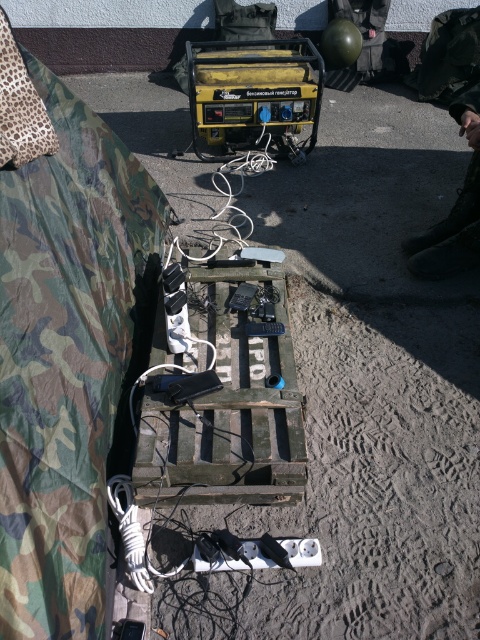
Can you confirm if yellow plastic generator at center is smaller than white cable at center?

No.

Is the position of yellow plastic generator at center more distant than that of white cable at center?

Yes, it is behind white cable at center.

The height and width of the screenshot is (640, 480). In order to click on yellow plastic generator at center in this screenshot , I will do `click(252, 93)`.